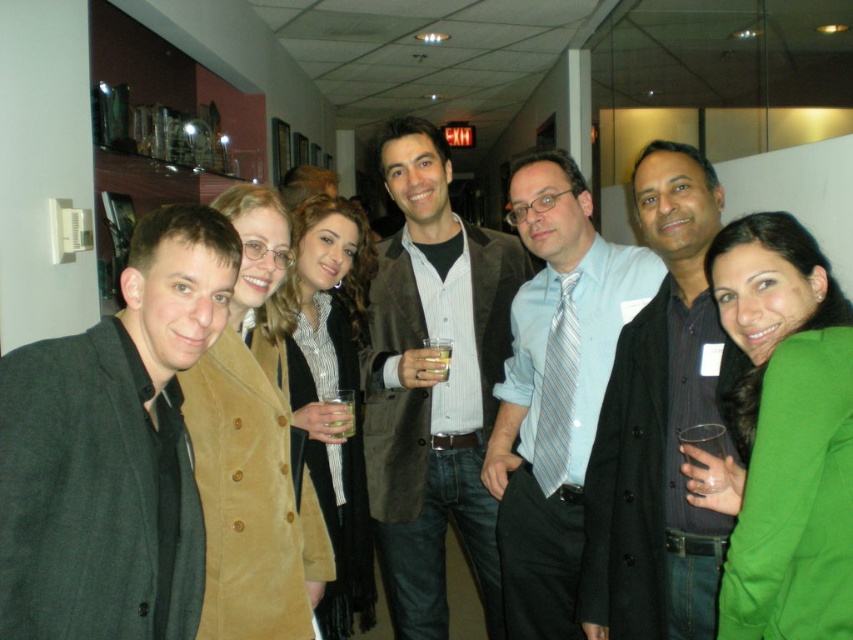
You are standing in the hallway where the group is posing. You want to move to the point marked at coordinates point (323, 321). If you are 1.7 meters tall, will your head hit the ceiling tiles above you as you walk there?

The point marked at coordinates point (323, 321) is 2.30 meters away from you. Since the ceiling height isn not mentioned, we can assume it is standard, so your head likely won t hit the ceiling tiles.

You are a photographer at this event and need to ensure that the dark gray coat at center and the translucent plastic cup at center are both visible in the photo. Given that the camera can only focus on objects wider than 10 cm, will both objects be in focus?

The dark gray coat at center is wider than the translucent plastic cup at center. Since the camera focuses on objects wider than 10 cm, the dark gray coat at center will be in focus. However, the translucent plastic cup at center might not be if it is narrower than 10 cm. The description does not specify the exact width of the cup, only that the coat is wider than it.

You are standing in the hallway and need to find the dark gray coat at center. According to the coordinates provided, where should you look relative to the exit sign?

The dark gray coat at center is located at point coordinates closer to the exit sign since its coordinates are at 0.664 on the x and 0.774 on the y, which places it near the center of the image where the exit sign is also visible in the background.